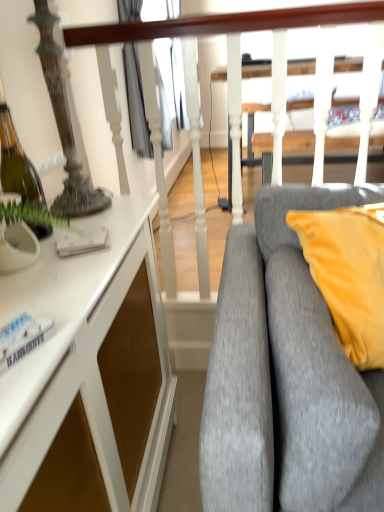
Question: Is white textured rail at upper center further to camera compared to white glossy cabinet at left?

Choices:
 (A) yes
 (B) no

Answer: (A)

Question: From the image's perspective, is white textured rail at upper center above white glossy cabinet at left?

Choices:
 (A) yes
 (B) no

Answer: (A)

Question: Is white glossy cabinet at left located within white textured rail at upper center?

Choices:
 (A) no
 (B) yes

Answer: (A)

Question: Can you confirm if white textured rail at upper center is positioned to the right of white glossy cabinet at left?

Choices:
 (A) no
 (B) yes

Answer: (B)

Question: Does white textured rail at upper center have a larger size compared to white glossy cabinet at left?

Choices:
 (A) yes
 (B) no

Answer: (B)

Question: From the image's perspective, relative to white glossy cabinet at left, is white textured rail at upper center above or below?

Choices:
 (A) above
 (B) below

Answer: (A)

Question: Is white textured rail at upper center to the left or to the right of white glossy cabinet at left in the image?

Choices:
 (A) left
 (B) right

Answer: (B)

Question: Is white textured rail at upper center in front of or behind white glossy cabinet at left in the image?

Choices:
 (A) behind
 (B) front

Answer: (A)

Question: Is white textured rail at upper center taller or shorter than white glossy cabinet at left?

Choices:
 (A) short
 (B) tall

Answer: (B)

Question: Does point (337, 16) appear closer or farther from the camera than point (286, 225)?

Choices:
 (A) closer
 (B) farther

Answer: (B)

Question: Looking at their shapes, would you say white textured rail at upper center is wider or thinner than gray fabric couch at right?

Choices:
 (A) thin
 (B) wide

Answer: (A)

Question: From a real-world perspective, is white textured rail at upper center above or below gray fabric couch at right?

Choices:
 (A) below
 (B) above

Answer: (B)

Question: Is white textured rail at upper center inside the boundaries of gray fabric couch at right, or outside?

Choices:
 (A) outside
 (B) inside

Answer: (A)

Question: Considering the positions of gray fabric couch at right and white textured rail at upper center in the image, is gray fabric couch at right taller or shorter than white textured rail at upper center?

Choices:
 (A) short
 (B) tall

Answer: (A)

Question: Is gray fabric couch at right bigger or smaller than white textured rail at upper center?

Choices:
 (A) big
 (B) small

Answer: (B)